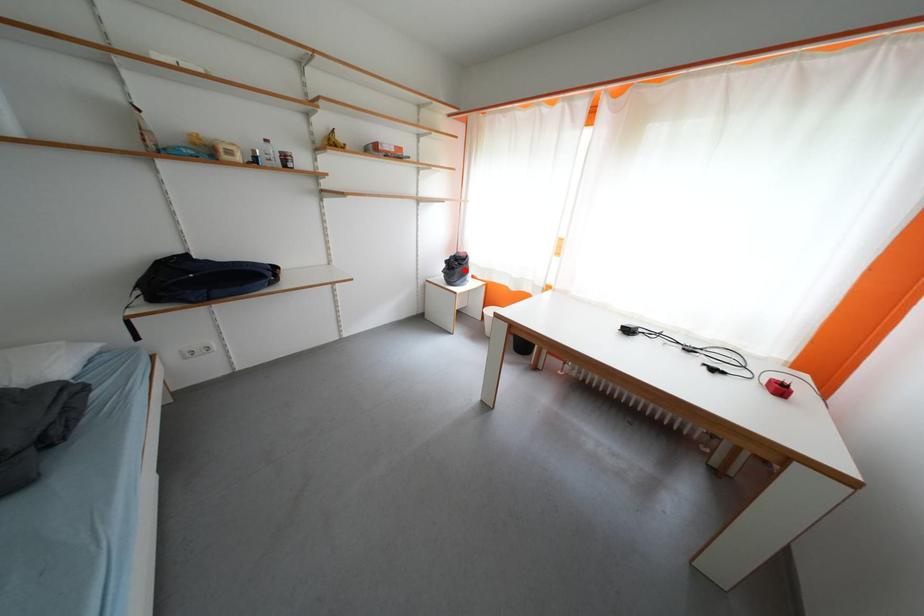
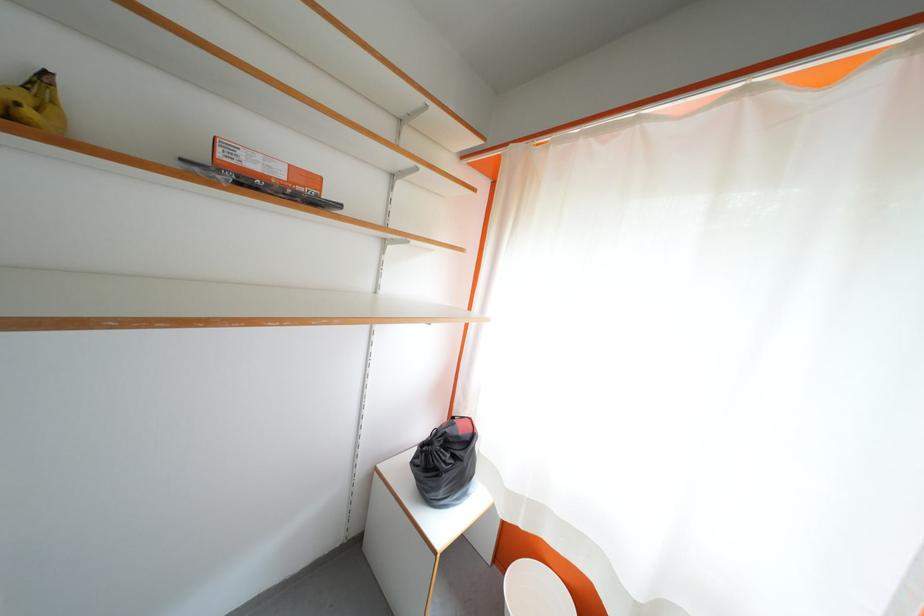
Where in the second image is the point corresponding to the highlighted location from the first image?

(455, 460)